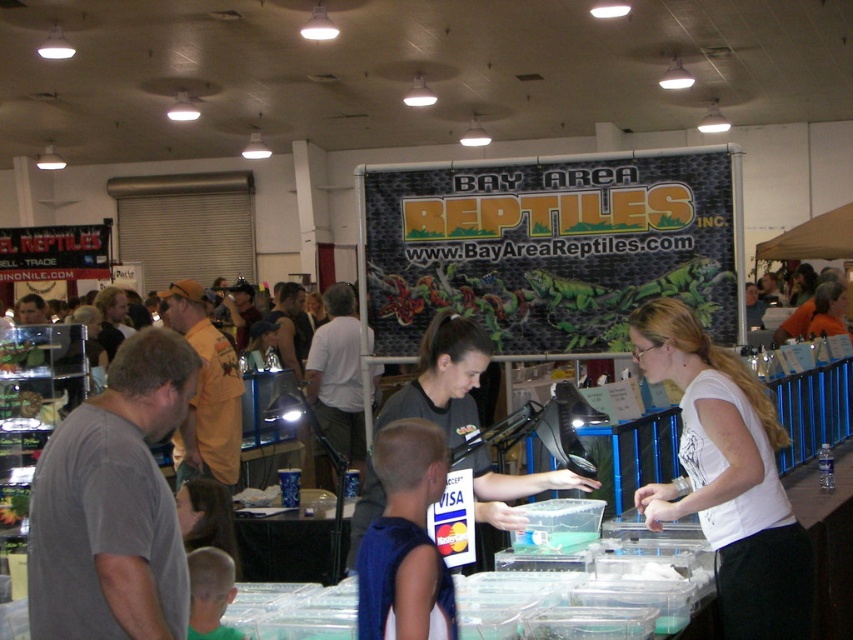
You are a vendor at the reptile market and need to determine which volunteer has a wider shirt to use for a demonstration. Which volunteer has a wider shirt between the white matte shirt at center and the dark gray shirt at center?

The dark gray shirt at center is wider than the white matte shirt at center, so the volunteer wearing the dark gray shirt at center has the wider shirt.